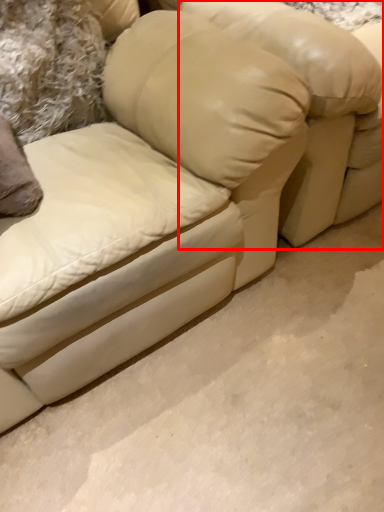
Question: From the image's perspective, where is bean bag chair (annotated by the red box) located in relation to pillow in the image?

Choices:
 (A) below
 (B) above

Answer: (B)